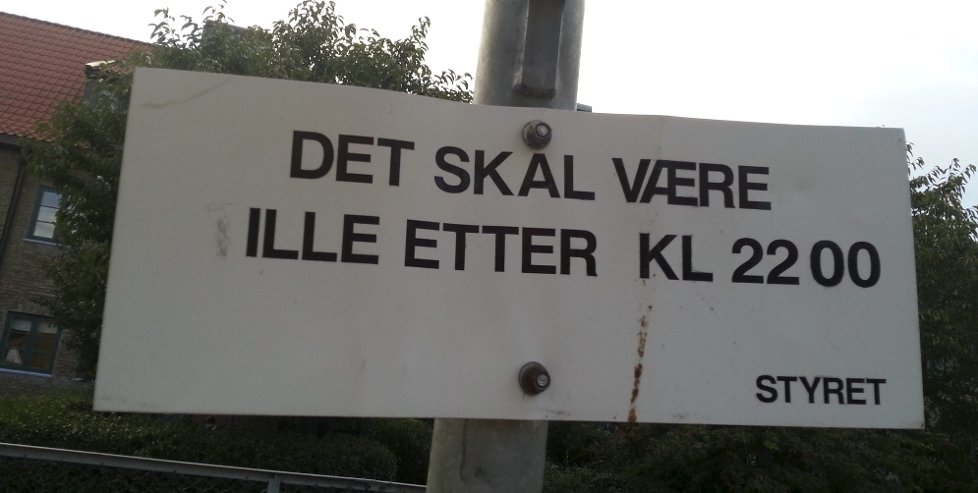
Find the location of a particular element. chimney is located at coordinates (229, 30).